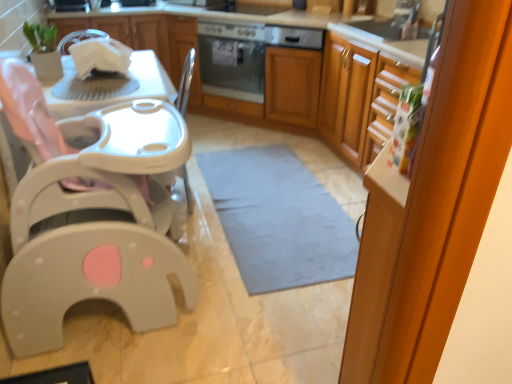
Locate an element on the screen. satin silver oven at center is located at coordinates 232,60.

What is the approximate width of satin silver oven at center?

35.82 centimeters.

Where is `white glossy cabinet at upper left, the 2th cabinetry from the right`? white glossy cabinet at upper left, the 2th cabinetry from the right is located at coordinates (149, 40).

This screenshot has width=512, height=384. Describe the element at coordinates (433, 205) in the screenshot. I see `transparent glass screen door at right` at that location.

Locate an element on the screen. This screenshot has width=512, height=384. wooden cabinets at center, arranged as the 1th cabinetry when viewed from the right is located at coordinates (286, 71).

The image size is (512, 384). I want to click on white plastic baby carriage at left, so click(x=99, y=227).

The width and height of the screenshot is (512, 384). Find the location of `satin silver oven at center`. satin silver oven at center is located at coordinates (232, 60).

Is wooden cabinets at center, arranged as the 1th cabinetry when viewed from the right, touching white plastic baby carriage at left?

wooden cabinets at center, arranged as the 1th cabinetry when viewed from the right, and white plastic baby carriage at left are not in contact.

Considering the relative sizes of wooden cabinets at center, arranged as the 1th cabinetry when viewed from the right, and white plastic baby carriage at left in the image provided, is wooden cabinets at center, arranged as the 1th cabinetry when viewed from the right, shorter than white plastic baby carriage at left?

Indeed, wooden cabinets at center, arranged as the 1th cabinetry when viewed from the right, has a lesser height compared to white plastic baby carriage at left.

Locate an element on the screen. cabinetry below the white plastic baby carriage at left (from a real-world perspective) is located at coordinates (286, 71).

Is wooden cabinets at center, which is the second cabinetry from left to right, inside the boundaries of white plastic baby carriage at left, or outside?

wooden cabinets at center, which is the second cabinetry from left to right, lies outside white plastic baby carriage at left.

Could you tell me if white glossy dishwasher at upper center is turned towards white plastic baby carriage at left?

Yes, white glossy dishwasher at upper center is facing white plastic baby carriage at left.

Looking at this image, considering the sizes of objects white glossy dishwasher at upper center and white plastic baby carriage at left in the image provided, who is bigger, white glossy dishwasher at upper center or white plastic baby carriage at left?

With larger size is white plastic baby carriage at left.

How much distance is there between white glossy dishwasher at upper center and white plastic baby carriage at left?

white glossy dishwasher at upper center is 1.98 meters from white plastic baby carriage at left.

Which object is closer to the camera taking this photo, white glossy dishwasher at upper center or white plastic baby carriage at left?

white plastic baby carriage at left is closer to the camera.

I want to click on cabinetry that is the 1st object located behind the transparent glass screen door at right, so click(286, 71).

In terms of height, does transparent glass screen door at right look taller or shorter compared to wooden cabinets at center, arranged as the 1th cabinetry when viewed from the right?

In the image, transparent glass screen door at right appears to be shorter than wooden cabinets at center, arranged as the 1th cabinetry when viewed from the right.

From the picture: Does transparent glass screen door at right come behind wooden cabinets at center, which is the second cabinetry from left to right?

No, it is in front of wooden cabinets at center, which is the second cabinetry from left to right.

Does point (445, 101) appear closer or farther from the camera than point (137, 23)?

Point (445, 101) appears to be closer to the viewer than point (137, 23).

Does satin silver oven at center have a larger size compared to white glossy cabinet at upper left, the 1th cabinetry when ordered from left to right?

No.

Does satin silver oven at center turn towards white glossy cabinet at upper left, the 1th cabinetry when ordered from left to right?

No, satin silver oven at center is not aimed at white glossy cabinet at upper left, the 1th cabinetry when ordered from left to right.

From the picture: Is the position of satin silver oven at center less distant than that of white glossy cabinet at upper left, the 2th cabinetry from the right?

Yes, the depth of satin silver oven at center is less than that of white glossy cabinet at upper left, the 2th cabinetry from the right.

Between satin silver oven at center and white glossy cabinet at upper left, the 1th cabinetry when ordered from left to right, which one appears on the left side from the viewer's perspective?

Positioned to the left is white glossy cabinet at upper left, the 1th cabinetry when ordered from left to right.

Consider the image. From the image's perspective, would you say white glossy dishwasher at upper center is shown under transparent glass screen door at right?

No, from the image's perspective, white glossy dishwasher at upper center is not below transparent glass screen door at right.

Between point (282, 36) and point (478, 86), which one is positioned in front?

Positioned in front is point (478, 86).

Who is more distant, white glossy dishwasher at upper center or transparent glass screen door at right?

white glossy dishwasher at upper center.

Looking at this image, considering their positions, is satin silver oven at center located in front of or behind white glossy dishwasher at upper center?

Clearly, satin silver oven at center is behind white glossy dishwasher at upper center.

Based on the photo, from a real-world perspective, is satin silver oven at center positioned under white glossy dishwasher at upper center based on gravity?

Correct, in the physical world, satin silver oven at center is lower than white glossy dishwasher at upper center.

Is point (245, 60) farther from viewer compared to point (314, 38)?

Yes, it is behind point (314, 38).

Considering the relative sizes of satin silver oven at center and white glossy dishwasher at upper center in the image provided, is satin silver oven at center smaller than white glossy dishwasher at upper center?

Incorrect, satin silver oven at center is not smaller in size than white glossy dishwasher at upper center.

Which is behind, point (158, 31) or point (18, 287)?

Point (158, 31)

At what (x,y) coordinates should I click in order to perform the action: click on cabinetry above the white plastic baby carriage at left (from a real-world perspective). Please return your answer as a coordinate pair (x, y). Looking at the image, I should click on (149, 40).

Where is `cabinetry below the white plastic baby carriage at left (from a real-world perspective)`? cabinetry below the white plastic baby carriage at left (from a real-world perspective) is located at coordinates (286, 71).

Image resolution: width=512 pixels, height=384 pixels. Find the location of `kitchen appliance above the white plastic baby carriage at left (from a real-world perspective)`. kitchen appliance above the white plastic baby carriage at left (from a real-world perspective) is located at coordinates (293, 37).

Looking at the image, which one is located closer to white glossy dishwasher at upper center, gray fabric mat at center or transparent glass screen door at right?

Based on the image, gray fabric mat at center appears to be nearer to white glossy dishwasher at upper center.

Considering their positions, is satin silver oven at center positioned further to white plastic baby carriage at left than white glossy dishwasher at upper center?

Based on the image, satin silver oven at center appears to be further to white plastic baby carriage at left.

Based on their spatial positions, is gray fabric mat at center or wooden cabinets at center, which is the second cabinetry from left to right, closer to transparent glass screen door at right?

gray fabric mat at center.

Estimate the real-world distances between objects in this image. Which object is closer to white plastic baby carriage at left, white glossy cabinet at upper left, the 1th cabinetry when ordered from left to right, or wooden cabinets at center, arranged as the 1th cabinetry when viewed from the right?

Based on the image, wooden cabinets at center, arranged as the 1th cabinetry when viewed from the right, appears to be nearer to white plastic baby carriage at left.

When comparing their distances from white glossy dishwasher at upper center, does white plastic baby carriage at left or white glossy cabinet at upper left, the 1th cabinetry when ordered from left to right, seem further?

The object further to white glossy dishwasher at upper center is white plastic baby carriage at left.

Which object lies nearer to the anchor point gray fabric mat at center, wooden cabinets at center, which is the second cabinetry from left to right, or white glossy cabinet at upper left, the 2th cabinetry from the right?

Based on the image, wooden cabinets at center, which is the second cabinetry from left to right, appears to be nearer to gray fabric mat at center.

From the image, which object appears to be farther from white glossy dishwasher at upper center, white plastic baby carriage at left or transparent glass screen door at right?

transparent glass screen door at right lies further to white glossy dishwasher at upper center than the other object.

Considering their positions, is transparent glass screen door at right positioned further to white glossy dishwasher at upper center than wooden cabinets at center, which is the second cabinetry from left to right?

transparent glass screen door at right is further to white glossy dishwasher at upper center.

Find the location of a particular element. Image resolution: width=512 pixels, height=384 pixels. cabinetry between transparent glass screen door at right and satin silver oven at center in the front-back direction is located at coordinates (286, 71).

Locate an element on the screen. The height and width of the screenshot is (384, 512). baby carriage between transparent glass screen door at right and white glossy dishwasher at upper center along the z-axis is located at coordinates (99, 227).

This screenshot has width=512, height=384. In order to click on cabinetry between white plastic baby carriage at left and white glossy dishwasher at upper center in the front-back direction in this screenshot , I will do `click(286, 71)`.

In order to click on home appliance between white glossy dishwasher at upper center and gray fabric mat at center in the vertical direction in this screenshot , I will do `click(232, 60)`.